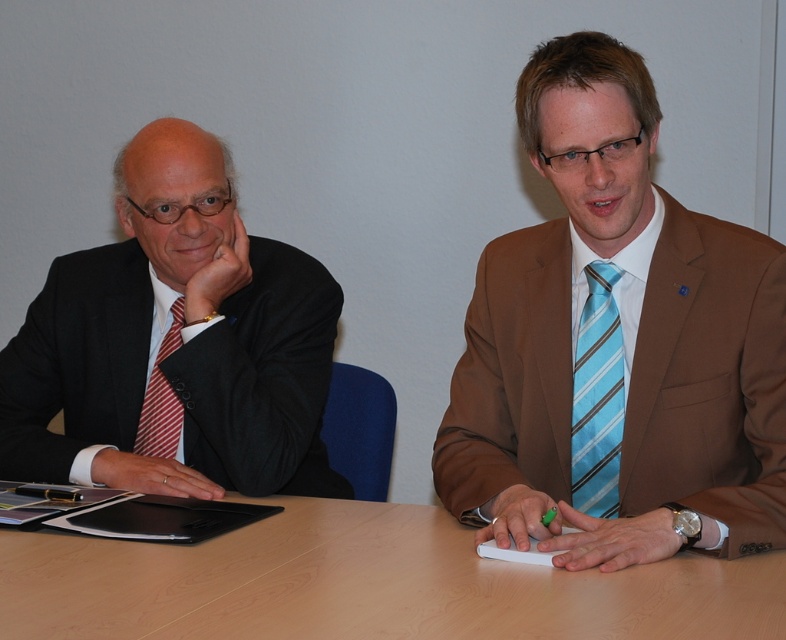
You are organizing a small conference and need to place a 1.2 meter wide banner on the table. Given the light brown wood table at center and the blue striped tie at right, can the banner fit on the table without overlapping the tie?

The light brown wood table at center is wider than the blue striped tie at right. Since the banner is 1.2 meters wide, it depends on the actual dimensions of the table. However, the description only states the table is wider than the tie, not its exact size. Therefore, we cannot confirm if the banner will fit without more information about the table dimensions.